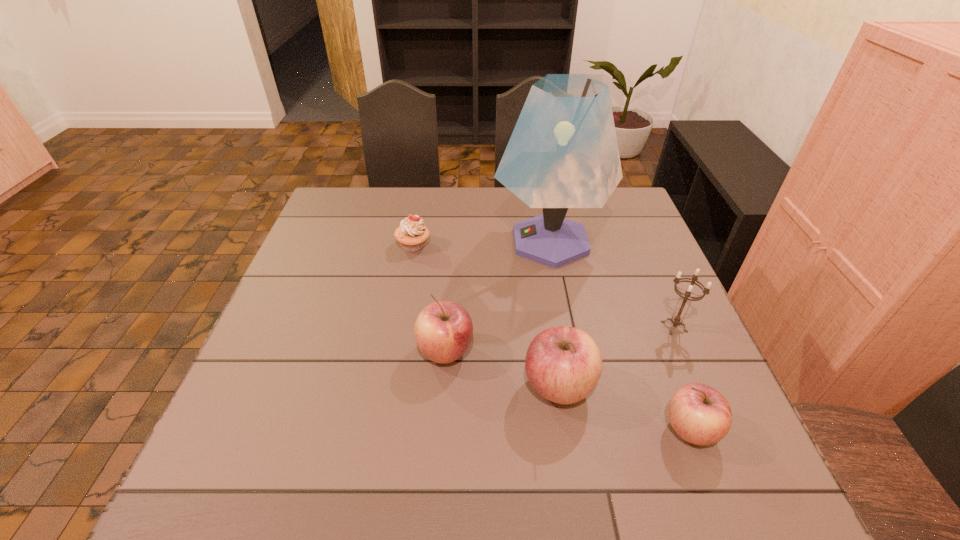
Where is `free space for a new apple on the left`? The height and width of the screenshot is (540, 960). free space for a new apple on the left is located at coordinates (348, 320).